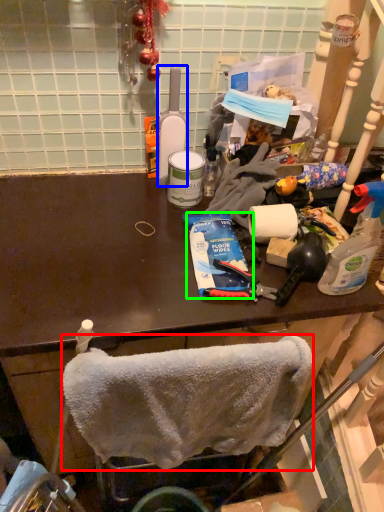
Question: Which object is positioned farthest from towel/napkin (highlighted by a red box)? Select from bottle (highlighted by a blue box) and toothpaste (highlighted by a green box).

Choices:
 (A) bottle
 (B) toothpaste

Answer: (A)